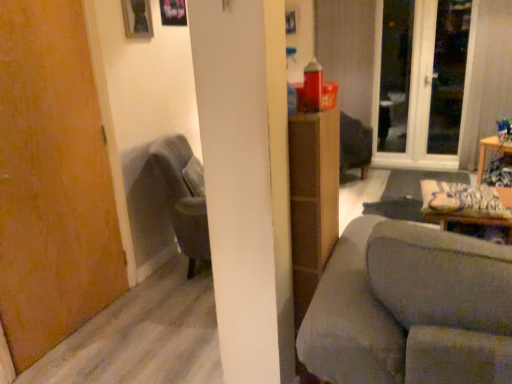
Question: Considering the relative sizes of white glass screen door at upper right and gray fabric couch at center in the image provided, is white glass screen door at upper right shorter than gray fabric couch at center?

Choices:
 (A) yes
 (B) no

Answer: (B)

Question: Is white glass screen door at upper right oriented away from gray fabric couch at center?

Choices:
 (A) no
 (B) yes

Answer: (A)

Question: Can you confirm if white glass screen door at upper right is bigger than gray fabric couch at center?

Choices:
 (A) no
 (B) yes

Answer: (A)

Question: Is gray fabric couch at center located within white glass screen door at upper right?

Choices:
 (A) yes
 (B) no

Answer: (B)

Question: From the image's perspective, would you say white glass screen door at upper right is shown under gray fabric couch at center?

Choices:
 (A) yes
 (B) no

Answer: (B)

Question: Can you confirm if white glass screen door at upper right is smaller than gray fabric couch at center?

Choices:
 (A) no
 (B) yes

Answer: (B)

Question: Is velvet grey armchair at left not close to transparent glass window at upper right?

Choices:
 (A) no
 (B) yes

Answer: (B)

Question: Is velvet grey armchair at left further to the viewer compared to transparent glass window at upper right?

Choices:
 (A) no
 (B) yes

Answer: (A)

Question: Is velvet grey armchair at left shorter than transparent glass window at upper right?

Choices:
 (A) no
 (B) yes

Answer: (B)

Question: Is velvet grey armchair at left wider than transparent glass window at upper right?

Choices:
 (A) no
 (B) yes

Answer: (B)

Question: Does velvet grey armchair at left have a smaller size compared to transparent glass window at upper right?

Choices:
 (A) yes
 (B) no

Answer: (B)

Question: Is transparent glass window at upper right located within velvet grey armchair at left?

Choices:
 (A) no
 (B) yes

Answer: (A)

Question: Does gray fabric couch at center have a larger size compared to velvet grey armchair at left?

Choices:
 (A) yes
 (B) no

Answer: (A)